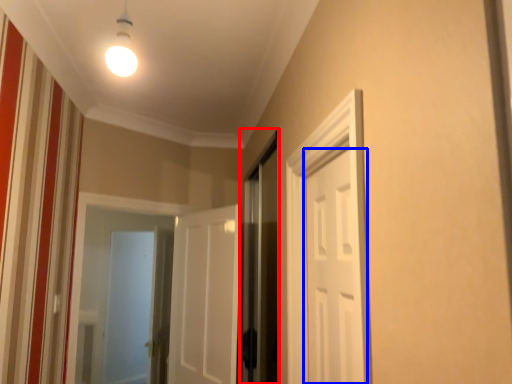
Question: Which point is further to the camera, screen door (highlighted by a red box) or door (highlighted by a blue box)?

Choices:
 (A) screen door
 (B) door

Answer: (A)